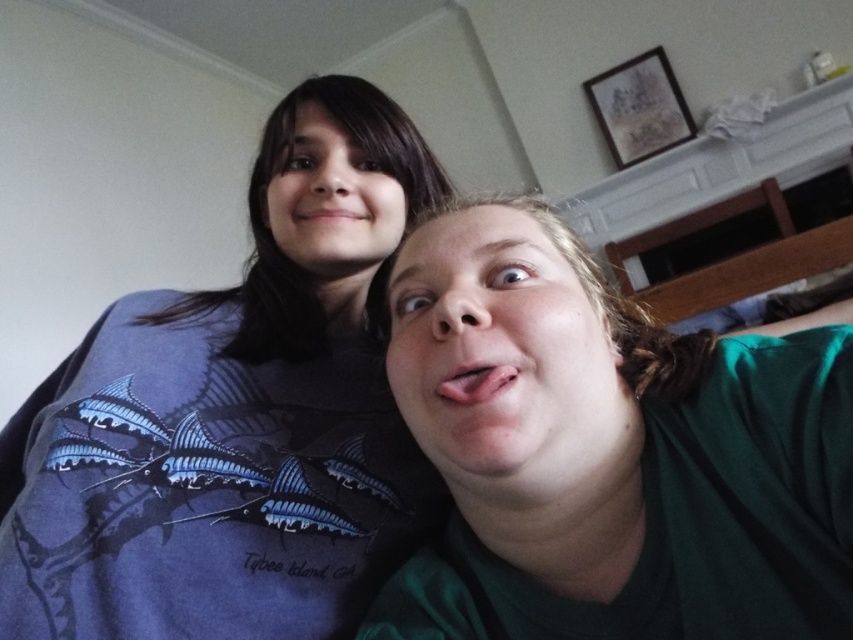
Question: Does blue matte shirt at upper left have a larger size compared to green matte shirt at lower right?

Choices:
 (A) yes
 (B) no

Answer: (A)

Question: Which of the following is the farthest from the observer?

Choices:
 (A) (625, 490)
 (B) (384, 173)

Answer: (B)

Question: Is blue matte shirt at upper left further to the viewer compared to green matte shirt at lower right?

Choices:
 (A) yes
 (B) no

Answer: (A)

Question: Which point is closer to the camera taking this photo?

Choices:
 (A) (405, 166)
 (B) (589, 291)

Answer: (B)

Question: Can you confirm if blue matte shirt at upper left is bigger than green matte shirt at lower right?

Choices:
 (A) no
 (B) yes

Answer: (B)

Question: Which object appears closest to the camera in this image?

Choices:
 (A) green matte shirt at lower right
 (B) blue matte shirt at upper left

Answer: (A)